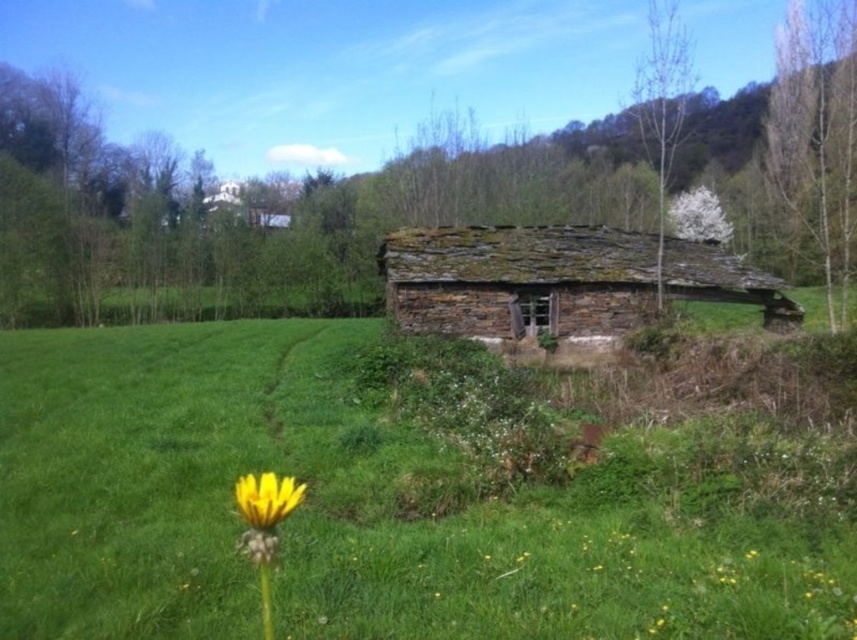
You are a gardener who needs to plant a new tree in the green grassy area at center. Considering the size of the green grassy at center and the rusty stone log cabin at center, can you estimate if the area is large enough to accommodate a tree that requires a 3 meter diameter space?

The green grassy at center has a smaller size compared to the rusty stone log cabin at center. Since the grassy area is smaller than the cabin, it might not provide enough space for a tree needing a 3 meter diameter. Check the exact dimensions before planting.

You are standing in the field and want to take a photo of the rusty stone log cabin at center and the yellow matte flower at lower left. Which object should you focus on first if you want to include both in your frame without moving the camera?

The rusty stone log cabin at center is positioned on the right side of yellow matte flower at lower left, so you should focus on the yellow matte flower at lower left first to ensure both are in the frame without moving the camera.

Based on the photo, you are a gardener who needs to plant a new flower in the green grassy at center. The yellow matte flower at lower left is already there. Which area has more space for planting?

The green grassy at center has more space for planting since it is bigger than the yellow matte flower at lower left.